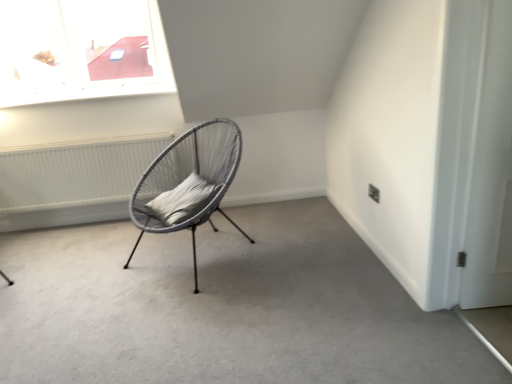
Image resolution: width=512 pixels, height=384 pixels. What do you see at coordinates (223, 307) in the screenshot? I see `matte gray chair at center` at bounding box center [223, 307].

Where is `white textured radiator at left`? white textured radiator at left is located at coordinates (75, 172).

From the image's perspective, is gray fabric pillow at center located above white textured radiator at left?

No, from the image's perspective, gray fabric pillow at center is not over white textured radiator at left.

Is point (200, 177) in front of point (36, 194)?

Yes.

Considering the relative sizes of gray fabric pillow at center and white textured radiator at left in the image provided, is gray fabric pillow at center wider than white textured radiator at left?

Indeed, gray fabric pillow at center has a greater width compared to white textured radiator at left.

This screenshot has width=512, height=384. What are the coordinates of `pillow lying in front of the white textured radiator at left` in the screenshot? It's located at (183, 200).

Consider the image. Considering the sizes of gray fabric pillow at center and matte grey wicker chair at center in the image, is gray fabric pillow at center taller or shorter than matte grey wicker chair at center?

gray fabric pillow at center is shorter than matte grey wicker chair at center.

How much distance is there between gray fabric pillow at center and matte grey wicker chair at center?

gray fabric pillow at center and matte grey wicker chair at center are 4.26 inches apart.

In terms of width, does gray fabric pillow at center look wider or thinner when compared to matte grey wicker chair at center?

In the image, gray fabric pillow at center appears to be more narrow than matte grey wicker chair at center.

Which is closer, (183, 201) or (158, 164)?

The point (183, 201) is in front.

Is white matte door at right not within white textured radiator at left?

white matte door at right lies outside white textured radiator at left's area.

In terms of height, does white matte door at right look taller or shorter compared to white textured radiator at left?

Considering their sizes, white matte door at right has more height than white textured radiator at left.

Is white matte door at right thinner than white textured radiator at left?

Correct, the width of white matte door at right is less than that of white textured radiator at left.

Could you tell me if white matte door at right is turned towards white textured radiator at left?

No, white matte door at right does not turn towards white textured radiator at left.

Looking at this image, considering the sizes of white textured radiator at left and gray fabric pillow at center in the image, is white textured radiator at left wider or thinner than gray fabric pillow at center?

Considering their sizes, white textured radiator at left looks slimmer than gray fabric pillow at center.

Would you say white textured radiator at left is a long distance from gray fabric pillow at center?

No, white textured radiator at left is not far from gray fabric pillow at center.

Is white textured radiator at left bigger than gray fabric pillow at center?

Indeed, white textured radiator at left has a larger size compared to gray fabric pillow at center.

Which point is more forward, (29, 159) or (176, 203)?

The point (176, 203) is in front.

From a real-world perspective, is gray fabric pillow at center positioned above or below white matte door at right?

From a real-world perspective, gray fabric pillow at center is physically below white matte door at right.

Considering the sizes of gray fabric pillow at center and white matte door at right in the image, is gray fabric pillow at center wider or thinner than white matte door at right?

In the image, gray fabric pillow at center appears to be wider than white matte door at right.

Could you tell me if gray fabric pillow at center is facing white matte door at right?

No, gray fabric pillow at center is not aimed at white matte door at right.

How far apart are gray fabric pillow at center and white matte door at right?

gray fabric pillow at center is 4.85 feet from white matte door at right.

Would you consider matte grey wicker chair at center to be distant from matte gray chair at center?

matte grey wicker chair at center is near matte gray chair at center, not far away.

Is matte grey wicker chair at center facing towards matte gray chair at center?

No, matte grey wicker chair at center is not facing towards matte gray chair at center.

From the image's perspective, relative to matte gray chair at center, is matte grey wicker chair at center above or below?

Based on their image positions, matte grey wicker chair at center is located above matte gray chair at center.

Considering the positions of points (230, 167) and (304, 277), is point (230, 167) closer to camera compared to point (304, 277)?

No, it is behind (304, 277).

From the picture: Is white matte door at right completely or partially outside of matte grey wicker chair at center?

Yes, white matte door at right is outside of matte grey wicker chair at center.

Does white matte door at right have a greater height compared to matte grey wicker chair at center?

Yes, white matte door at right is taller than matte grey wicker chair at center.

From the image's perspective, which object appears higher, white matte door at right or matte grey wicker chair at center?

white matte door at right is shown above in the image.

Is white matte door at right looking in the opposite direction of matte grey wicker chair at center?

No, white matte door at right is not facing the opposite direction of matte grey wicker chair at center.

At what (x,y) coordinates should I click in order to perform the action: click on radiator that is under the gray fabric pillow at center (from a real-world perspective). Please return your answer as a coordinate pair (x, y). Looking at the image, I should click on (75, 172).

Locate an element on the screen. pillow behind the matte grey wicker chair at center is located at coordinates (183, 200).

Based on their spatial positions, is white textured radiator at left or matte gray chair at center closer to white matte door at right?

matte gray chair at center.

Looking at the image, which one is located closer to gray fabric pillow at center, matte grey wicker chair at center or matte gray chair at center?

matte grey wicker chair at center lies closer to gray fabric pillow at center than the other object.

Considering their positions, is white textured radiator at left positioned further to matte gray chair at center than gray fabric pillow at center?

Among the two, white textured radiator at left is located further to matte gray chair at center.

When comparing their distances from white matte door at right, does matte gray chair at center or gray fabric pillow at center seem further?

Based on the image, gray fabric pillow at center appears to be further to white matte door at right.

Based on their spatial positions, is white textured radiator at left or matte grey wicker chair at center further from matte gray chair at center?

Based on the image, white textured radiator at left appears to be further to matte gray chair at center.

Looking at this image, estimate the real-world distances between objects in this image. Which object is closer to matte gray chair at center, white matte door at right or matte grey wicker chair at center?

matte grey wicker chair at center is positioned closer to the anchor matte gray chair at center.

Which object lies nearer to the anchor point matte gray chair at center, gray fabric pillow at center or white matte door at right?

Among the two, gray fabric pillow at center is located nearer to matte gray chair at center.

When comparing their distances from matte gray chair at center, does gray fabric pillow at center or matte grey wicker chair at center seem further?

gray fabric pillow at center is positioned further to the anchor matte gray chair at center.

I want to click on chair between matte gray chair at center and gray fabric pillow at center in the front-back direction, so click(188, 183).

Locate an element on the screen. concrete situated between white textured radiator at left and white matte door at right from left to right is located at coordinates (223, 307).

Locate an element on the screen. Image resolution: width=512 pixels, height=384 pixels. pillow between matte gray chair at center and white textured radiator at left from front to back is located at coordinates (183, 200).

The width and height of the screenshot is (512, 384). I want to click on chair located between white textured radiator at left and white matte door at right in the left-right direction, so click(x=188, y=183).